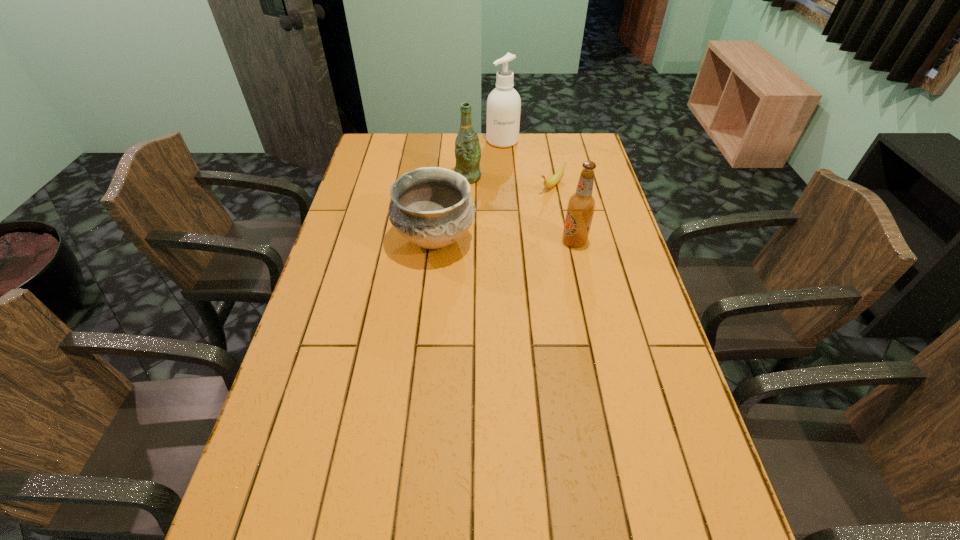
You are a GUI agent. You are given a task and a screenshot of the screen. Output one action in this format:
    pyautogui.click(x=<x>, y=<y>)
    Task: Click on the vacant space situated 0.220m on the surface of the farther beer bottle
    
    Given the screenshot: What is the action you would take?
    pyautogui.click(x=500, y=219)

The width and height of the screenshot is (960, 540). I want to click on vacant space located 0.130m on the surface of the farther beer bottle, so click(489, 204).

Locate an element on the screen. vacant space located 0.260m on the surface of the farther beer bottle is located at coordinates (505, 226).

Where is `blank space located on the front label of the farthest object`? The width and height of the screenshot is (960, 540). blank space located on the front label of the farthest object is located at coordinates (514, 206).

You are a GUI agent. You are given a task and a screenshot of the screen. Output one action in this format:
    pyautogui.click(x=<x>, y=<y>)
    Task: Click on the vacant space located on the front label of the farthest object
    The height and width of the screenshot is (540, 960).
    Given the screenshot: What is the action you would take?
    pyautogui.click(x=511, y=191)

Locate an element on the screen. The height and width of the screenshot is (540, 960). vacant space situated 0.120m on the front label of the farthest object is located at coordinates (507, 165).

Locate an element on the screen. Image resolution: width=960 pixels, height=540 pixels. vacant region located 0.130m at the stem of the shortest object is located at coordinates (525, 212).

What are the coordinates of `blank area located at the stem of the shortest object` in the screenshot? It's located at (535, 204).

This screenshot has width=960, height=540. What are the coordinates of `vacant area located at the stem of the shortest object` in the screenshot? It's located at (504, 232).

Where is `object situated at the far edge`? The image size is (960, 540). object situated at the far edge is located at coordinates (503, 104).